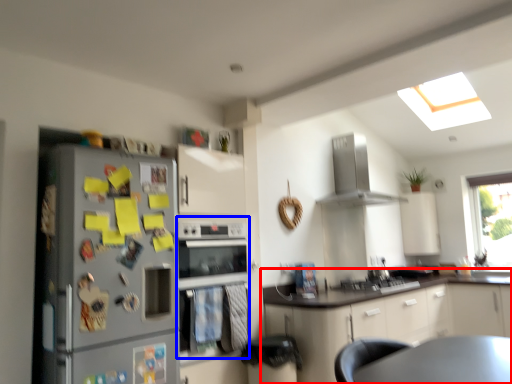
Question: Which object appears closest to the camera in this image, cabinetry (highlighted by a red box) or oven (highlighted by a blue box)?

Choices:
 (A) cabinetry
 (B) oven

Answer: (B)